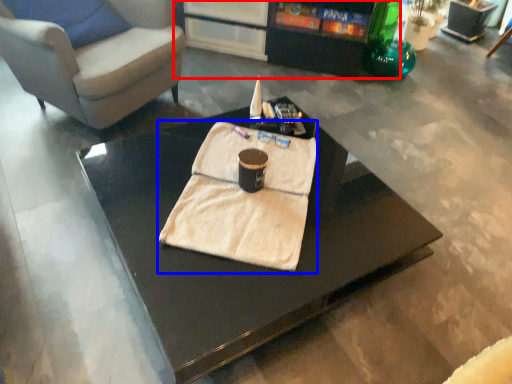
Question: Which point is closer to the camera, entertainment center (highlighted by a red box) or blanket (highlighted by a blue box)?

Choices:
 (A) entertainment center
 (B) blanket

Answer: (B)